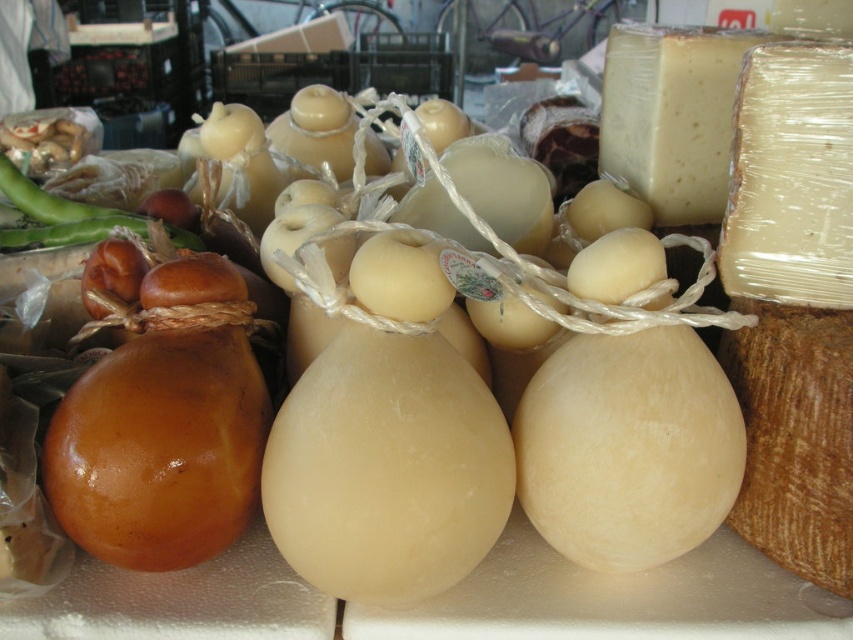
You are a customer at the cheese shop and want to place the white wrapped block of cheese at upper right and the translucent white cheese at upper right into a small basket that can hold items up to 10 inches apart. Will both items fit in the basket without overlapping?

The white wrapped block of cheese at upper right is 9.41 inches from the translucent white cheese at upper right. Since the basket can hold items up to 10 inches apart, the 9.41 inches distance between them means they can fit without overlapping.

You are a customer at the cheese shop and want to grab both the white wrapped block of cheese at upper right and the translucent white cheese at upper right. Which one should you pick up first if you want to reach the one closer to the edge of the counter?

The translucent white cheese at upper right should be picked up first because the white wrapped block of cheese at upper right is positioned on the right side of it, meaning the translucent one is closer to the edge of the counter.

You are a customer at the cheese shop and want to buy the smaller cheese. Which one should you choose between the white wrapped block of cheese at upper right and the translucent white cheese at upper right?

The white wrapped block of cheese at upper right is smaller than the translucent white cheese at upper right, so you should choose the white wrapped block of cheese at upper right.